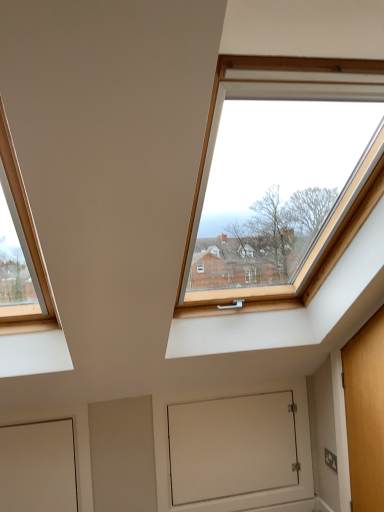
Question: Does white matte door at lower left, the first door from the left, have a lesser height compared to wooden door at right, marked as the 1th door in a right-to-left arrangement?

Choices:
 (A) yes
 (B) no

Answer: (A)

Question: Is wooden door at right, the second door viewed from the left, inside white matte door at lower left, the 2th door in the right-to-left sequence?

Choices:
 (A) yes
 (B) no

Answer: (B)

Question: Is the depth of white matte door at lower left, the first door from the left, greater than that of wooden door at right, marked as the 1th door in a right-to-left arrangement?

Choices:
 (A) no
 (B) yes

Answer: (B)

Question: Can you confirm if white matte door at lower left, the 2th door in the right-to-left sequence, is bigger than wooden door at right, marked as the 1th door in a right-to-left arrangement?

Choices:
 (A) yes
 (B) no

Answer: (B)

Question: Is white matte door at lower left, the first door from the left, wider than wooden door at right, the second door viewed from the left?

Choices:
 (A) no
 (B) yes

Answer: (A)

Question: Is the position of white matte door at lower left, the first door from the left, less distant than that of wooden door at right, marked as the 1th door in a right-to-left arrangement?

Choices:
 (A) no
 (B) yes

Answer: (A)

Question: Considering the relative sizes of white matte door at lower center and white matte door at lower left, the first door from the left, in the image provided, is white matte door at lower center thinner than white matte door at lower left, the first door from the left,?

Choices:
 (A) no
 (B) yes

Answer: (A)

Question: Is white matte door at lower center surrounding white matte door at lower left, the first door from the left?

Choices:
 (A) no
 (B) yes

Answer: (A)

Question: Can you confirm if white matte door at lower center is positioned to the right of white matte door at lower left, the 2th door in the right-to-left sequence?

Choices:
 (A) yes
 (B) no

Answer: (A)

Question: Is the position of white matte door at lower center less distant than that of white matte door at lower left, the 2th door in the right-to-left sequence?

Choices:
 (A) no
 (B) yes

Answer: (A)

Question: Is white matte door at lower center wider than white matte door at lower left, the 2th door in the right-to-left sequence?

Choices:
 (A) yes
 (B) no

Answer: (A)

Question: Is white matte door at lower center next to white matte door at lower left, the 2th door in the right-to-left sequence, and touching it?

Choices:
 (A) yes
 (B) no

Answer: (B)

Question: Is white matte door at lower left, the 2th door in the right-to-left sequence, wider than white matte door at lower center?

Choices:
 (A) yes
 (B) no

Answer: (B)